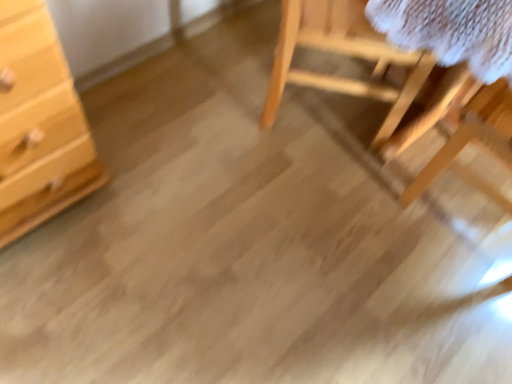
The height and width of the screenshot is (384, 512). In order to click on empty space that is in between light wood chest of drawers at left and wooden table at right in this screenshot , I will do `click(267, 203)`.